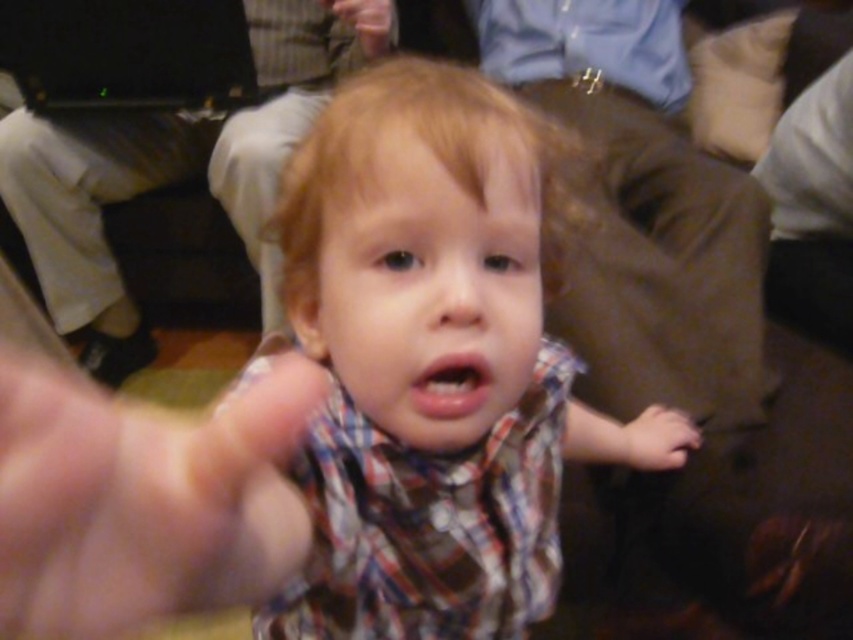
Is point (421, 68) less distant than point (180, 490)?

No, (421, 68) is behind (180, 490).

Between point (430, 368) and point (83, 474), which one is positioned behind?

The point (430, 368) is more distant.

Is point (474, 570) positioned behind point (90, 504)?

Yes.

Locate an element on the screen. Image resolution: width=853 pixels, height=640 pixels. plaid fabric toddler at center is located at coordinates tap(425, 372).